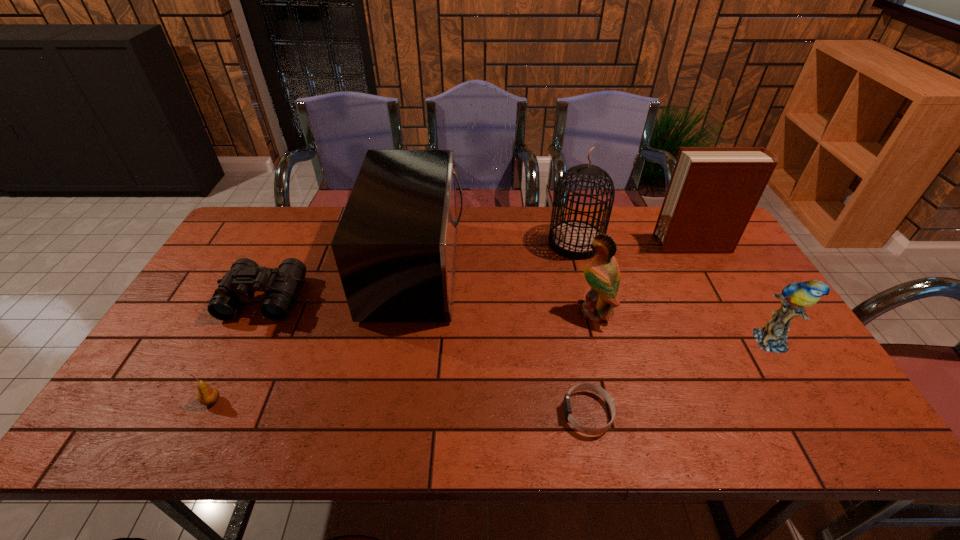
You are a GUI agent. You are given a task and a screenshot of the screen. Output one action in this format:
    pyautogui.click(x=<x>, y=<y>)
    Task: Click on the vacant space located 0.370m on the open cover of the hardback book
    
    Given the screenshot: What is the action you would take?
    pyautogui.click(x=543, y=245)

Image resolution: width=960 pixels, height=540 pixels. I want to click on vacant space located on the open cover of the hardback book, so click(616, 245).

Find the location of a particular element. vacant space located with the door open on the microwave oven is located at coordinates (543, 268).

Find the location of a particular element. vacant space located 0.360m on the front-facing side of the left parrot is located at coordinates (448, 312).

Where is `vacant region located on the front-facing side of the left parrot`? This screenshot has height=540, width=960. vacant region located on the front-facing side of the left parrot is located at coordinates (494, 312).

Where is `free space located 0.110m on the front-facing side of the left parrot`? free space located 0.110m on the front-facing side of the left parrot is located at coordinates (538, 312).

This screenshot has width=960, height=540. Identify the location of vacant region located 0.170m on the face of the right parrot. (820, 421).

Where is `free space located through the lenses of the sixth tallest object`? free space located through the lenses of the sixth tallest object is located at coordinates (227, 375).

Image resolution: width=960 pixels, height=540 pixels. Find the location of `vacant position located 0.120m on the right of the pear`. vacant position located 0.120m on the right of the pear is located at coordinates (273, 401).

The image size is (960, 540). What are the coordinates of `vacant position located 0.280m on the outer surface of the shortest object` in the screenshot? It's located at (442, 413).